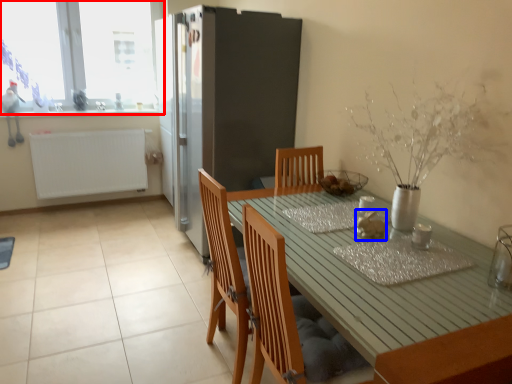
Question: Which point is further to the camera, window (highlighted by a red box) or food (highlighted by a blue box)?

Choices:
 (A) window
 (B) food

Answer: (A)